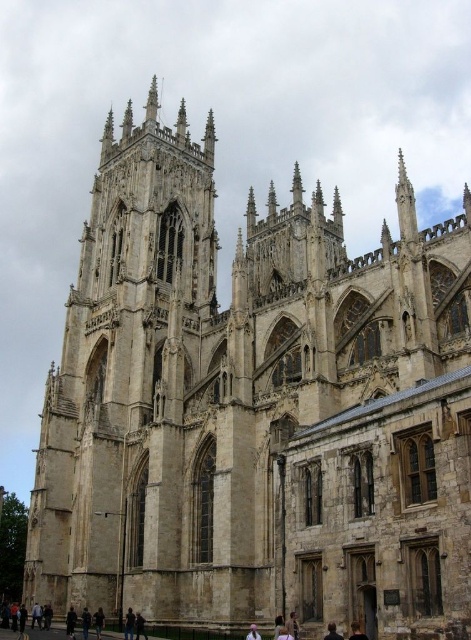
Question: Which is farther from the dark gray coat at lower left?

Choices:
 (A) black hair at lower center
 (B) dark brown leather jacket at lower center
 (C) dark blue fabric at lower center
 (D) stone spire at upper center

Answer: (D)

Question: Is dark gray coat at lower left positioned in front of dark brown leather backpack at lower center?

Choices:
 (A) yes
 (B) no

Answer: (A)

Question: Is the position of stone spire at upper center more distant than that of dark gray coat at lower left?

Choices:
 (A) no
 (B) yes

Answer: (B)

Question: Which object is closer to the camera taking this photo?

Choices:
 (A) stone spire at upper center
 (B) black hair at lower center
 (C) dark brown leather jacket at lower center

Answer: (B)

Question: Which point is farther to the camera?

Choices:
 (A) (97, 609)
 (B) (254, 637)

Answer: (A)

Question: Is stone spire at upper center to the left of dark brown leather backpack at lower center from the viewer's perspective?

Choices:
 (A) yes
 (B) no

Answer: (A)